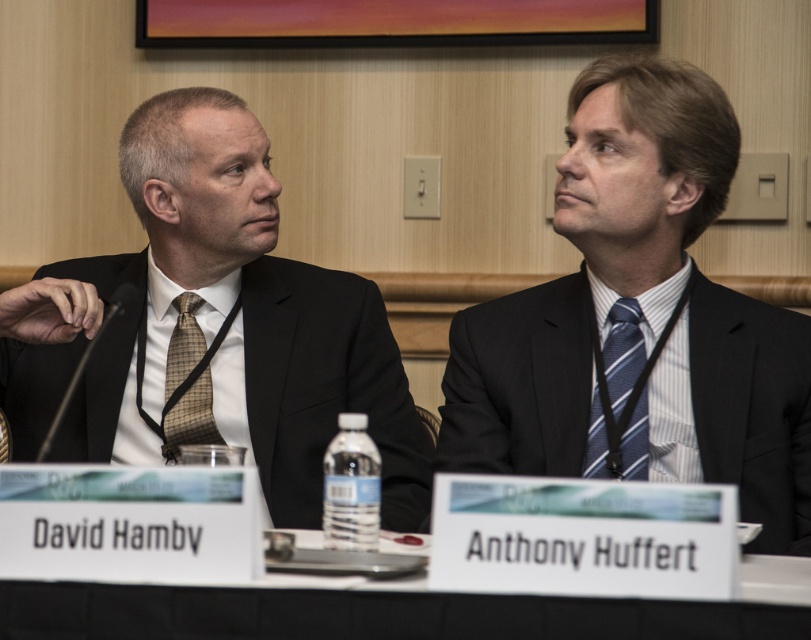
You are a photographer positioned at the back of the room. You need to take a photo of both the matte black suit at left and the matte black suit at center so that both are clearly visible. Which person should you focus on first to ensure both are in focus?

You should focus on the matte black suit at center first because it is farther away from the photographer than the matte black suit at left. By focusing on the farther person, the closer one will also be in focus due to the depth of field.

You are attending a virtual meeting and need to zoom in on one of the two points on the conference table. The points are located at coordinates point (x=637, y=465) and point (x=618, y=400). Which point should you select to ensure it appears larger in your view?

Point (x=637, y=465) is closer to the camera than point (x=618, y=400), so selecting it will make it appear larger in your view.